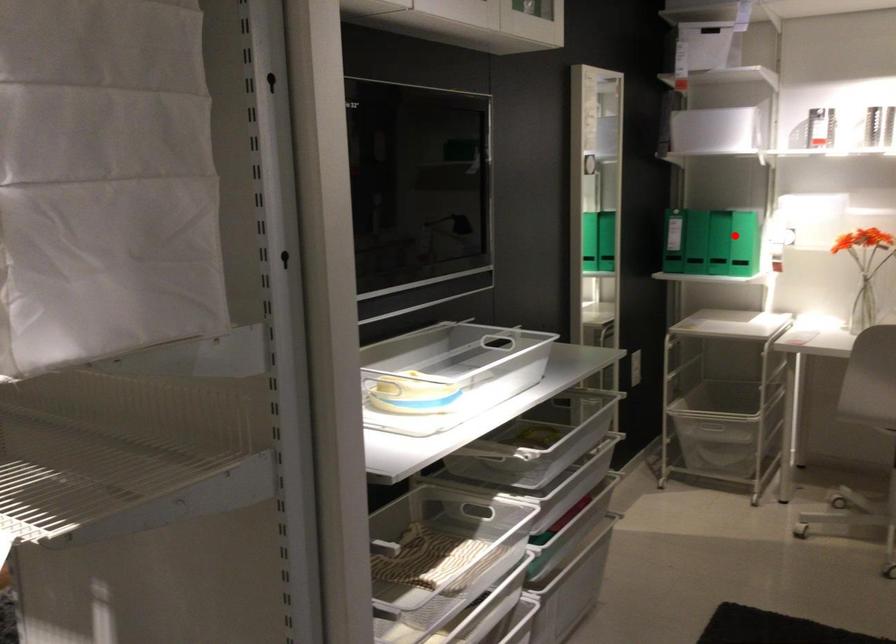
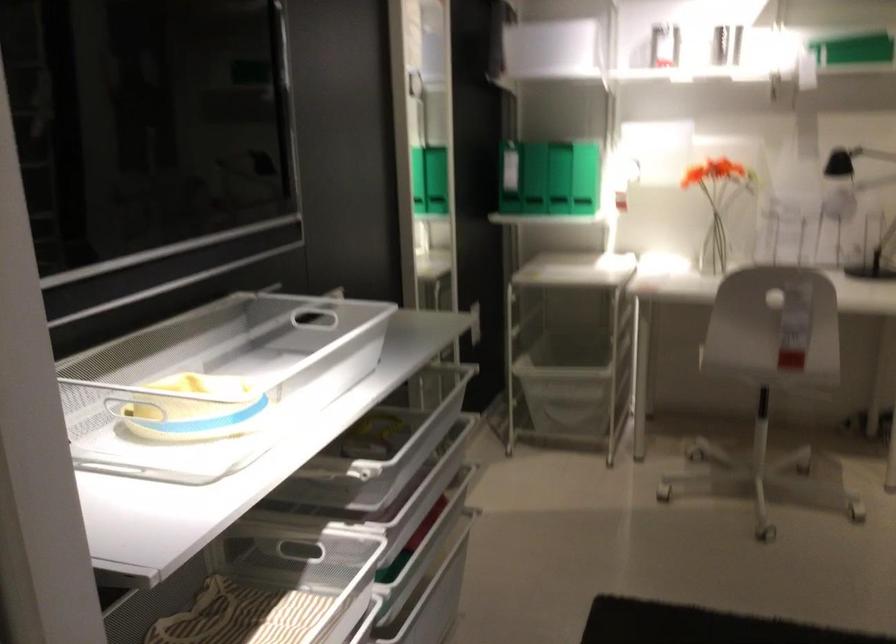
Where in the second image is the point corresponding to the highlighted location from the first image?

(558, 178)